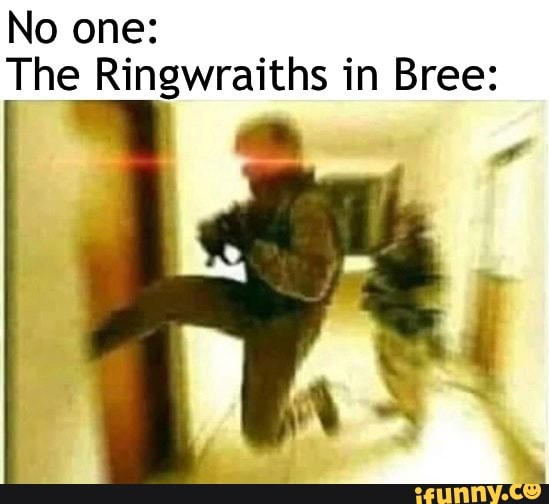
Find the location of `floor`. floor is located at coordinates (361, 350), (318, 443).